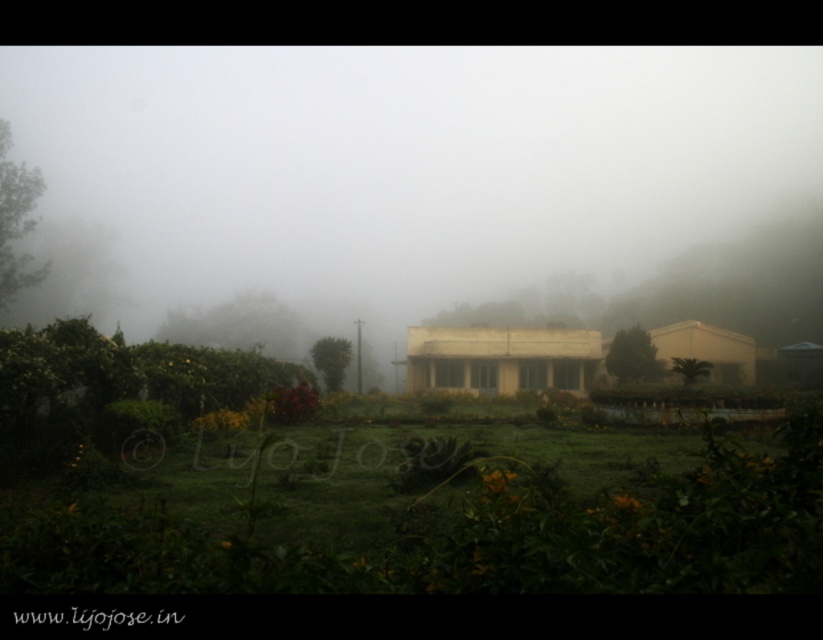
Does foggy white building at center have a smaller size compared to matte yellow building at center?

No, foggy white building at center is not smaller than matte yellow building at center.

Who is more forward, (x=452, y=60) or (x=656, y=332)?

Point (x=656, y=332) is in front.

Where is `foggy white building at center`? foggy white building at center is located at coordinates (394, 170).

Locate an element on the screen. foggy white building at center is located at coordinates (394, 170).

Where is `foggy white building at center`? The height and width of the screenshot is (640, 823). foggy white building at center is located at coordinates (394, 170).

Is point (442, 332) positioned after point (672, 356)?

No, it is in front of (672, 356).

Can you confirm if white concrete building at center is bigger than matte yellow building at center?

Actually, white concrete building at center might be smaller than matte yellow building at center.

Is point (524, 330) closer to camera compared to point (724, 349)?

Yes, it is in front of point (724, 349).

Locate an element on the screen. The height and width of the screenshot is (640, 823). white concrete building at center is located at coordinates (501, 358).